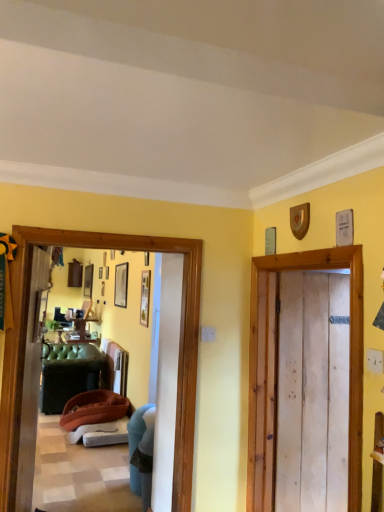
Question: From the image's perspective, is brown fabric couch at left beneath wooden picture frame at center, which is the second picture frame in back-to-front order?

Choices:
 (A) yes
 (B) no

Answer: (A)

Question: Is brown fabric couch at left thinner than wooden picture frame at center, which is the 1th picture frame from front to back?

Choices:
 (A) yes
 (B) no

Answer: (B)

Question: Does brown fabric couch at left lie behind wooden picture frame at center, which is the second picture frame in back-to-front order?

Choices:
 (A) yes
 (B) no

Answer: (B)

Question: Would you say brown fabric couch at left is a long distance from wooden picture frame at center, positioned as the first picture frame in right-to-left order?

Choices:
 (A) yes
 (B) no

Answer: (A)

Question: Is brown fabric couch at left outside of wooden picture frame at center, which is the second picture frame in back-to-front order?

Choices:
 (A) no
 (B) yes

Answer: (B)

Question: From a real-world perspective, relative to green fabric couch at left, is brown fabric couch at left vertically above or below?

Choices:
 (A) above
 (B) below

Answer: (B)

Question: Looking at the image, does brown fabric couch at left seem bigger or smaller compared to green fabric couch at left?

Choices:
 (A) small
 (B) big

Answer: (B)

Question: Considering the positions of brown fabric couch at left and green fabric couch at left in the image, is brown fabric couch at left taller or shorter than green fabric couch at left?

Choices:
 (A) tall
 (B) short

Answer: (B)

Question: Considering the relative positions of brown fabric couch at left and green fabric couch at left in the image provided, is brown fabric couch at left to the left or to the right of green fabric couch at left?

Choices:
 (A) right
 (B) left

Answer: (B)

Question: Considering their positions, is green fabric couch at left located in front of or behind teal fabric chair at lower left?

Choices:
 (A) front
 (B) behind

Answer: (A)

Question: Is green fabric couch at left wider or thinner than teal fabric chair at lower left?

Choices:
 (A) thin
 (B) wide

Answer: (A)

Question: From the image's perspective, relative to teal fabric chair at lower left, is green fabric couch at left above or below?

Choices:
 (A) below
 (B) above

Answer: (B)

Question: Would you say green fabric couch at left is inside or outside teal fabric chair at lower left?

Choices:
 (A) inside
 (B) outside

Answer: (B)

Question: Is matte black picture frame at upper center, acting as the first picture frame starting from the back, bigger or smaller than teal fabric chair at lower left?

Choices:
 (A) big
 (B) small

Answer: (B)

Question: In terms of width, does matte black picture frame at upper center, which is the 2th picture frame from right to left, look wider or thinner when compared to teal fabric chair at lower left?

Choices:
 (A) wide
 (B) thin

Answer: (B)